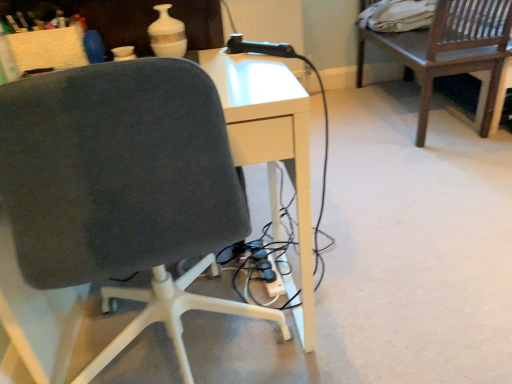
In order to face dark gray fabric chair at center, should I rotate leftwards or rightwards?

Turn left by 13.023 degrees to look at dark gray fabric chair at center.

This screenshot has width=512, height=384. What do you see at coordinates (122, 186) in the screenshot?
I see `dark gray fabric chair at center` at bounding box center [122, 186].

The width and height of the screenshot is (512, 384). I want to click on dark gray fabric chair at center, so click(122, 186).

Based on the photo, in order to face dark wood chair at upper right, should I rotate leftwards or rightwards?

Turn right by 21.095 degrees to look at dark wood chair at upper right.

Describe the element at coordinates (450, 50) in the screenshot. The height and width of the screenshot is (384, 512). I see `dark wood chair at upper right` at that location.

The width and height of the screenshot is (512, 384). What are the coordinates of `dark wood chair at upper right` in the screenshot? It's located at (450, 50).

Identify the location of dark gray fabric chair at center. pos(122,186).

Can you confirm if dark gray fabric chair at center is positioned to the left of dark wood chair at upper right?

Yes, dark gray fabric chair at center is to the left of dark wood chair at upper right.

Is dark gray fabric chair at center in front of or behind dark wood chair at upper right in the image?

Clearly, dark gray fabric chair at center is in front of dark wood chair at upper right.

Which is closer to the camera, (158, 252) or (490, 106)?

Point (158, 252) is positioned closer to the camera compared to point (490, 106).

From the image's perspective, between dark gray fabric chair at center and dark wood chair at upper right, who is located below?

dark gray fabric chair at center, from the image's perspective.

From a real-world perspective, which is physically above, dark gray fabric chair at center or dark wood chair at upper right?

In real-world perspective, dark gray fabric chair at center is above.

Which of these two, dark gray fabric chair at center or dark wood chair at upper right, is wider?

With larger width is dark gray fabric chair at center.

Considering the sizes of objects dark gray fabric chair at center and dark wood chair at upper right in the image provided, who is taller, dark gray fabric chair at center or dark wood chair at upper right?

dark gray fabric chair at center.

Does dark gray fabric chair at center have a larger size compared to dark wood chair at upper right?

Incorrect, dark gray fabric chair at center is not larger than dark wood chair at upper right.

Would you say dark gray fabric chair at center is outside dark wood chair at upper right?

That's correct, dark gray fabric chair at center is outside of dark wood chair at upper right.

From the picture: Is dark gray fabric chair at center far away from dark wood chair at upper right?

Indeed, dark gray fabric chair at center is not near dark wood chair at upper right.

Is dark gray fabric chair at center oriented towards dark wood chair at upper right?

No, dark gray fabric chair at center is not oriented towards dark wood chair at upper right.

Measure the distance between dark gray fabric chair at center and dark wood chair at upper right.

The distance of dark gray fabric chair at center from dark wood chair at upper right is 1.70 meters.

Image resolution: width=512 pixels, height=384 pixels. Find the location of `table below the dark gray fabric chair at center (from a real-world perspective)`. table below the dark gray fabric chair at center (from a real-world perspective) is located at coordinates (450, 50).

Can you confirm if dark wood chair at upper right is positioned to the right of dark gray fabric chair at center?

Correct, you'll find dark wood chair at upper right to the right of dark gray fabric chair at center.

Considering their positions, is dark wood chair at upper right located in front of or behind dark gray fabric chair at center?

Visually, dark wood chair at upper right is located behind dark gray fabric chair at center.

Which is nearer, (424, 85) or (18, 232)?

The point (18, 232) is closer.

From the image's perspective, is dark wood chair at upper right located above dark gray fabric chair at center?

Yes, from the image's perspective, dark wood chair at upper right is above dark gray fabric chair at center.

From a real-world perspective, is dark wood chair at upper right physically located above or below dark gray fabric chair at center?

Clearly, from a real-world perspective, dark wood chair at upper right is below dark gray fabric chair at center.

Is dark wood chair at upper right wider or thinner than dark gray fabric chair at center?

Considering their sizes, dark wood chair at upper right looks slimmer than dark gray fabric chair at center.

Considering the relative sizes of dark wood chair at upper right and dark gray fabric chair at center in the image provided, is dark wood chair at upper right shorter than dark gray fabric chair at center?

Yes.

Is dark wood chair at upper right bigger or smaller than dark gray fabric chair at center?

Clearly, dark wood chair at upper right is larger in size than dark gray fabric chair at center.

Is dark wood chair at upper right outside of dark gray fabric chair at center?

That's correct, dark wood chair at upper right is outside of dark gray fabric chair at center.

Is there a large distance between dark wood chair at upper right and dark gray fabric chair at center?

Absolutely, dark wood chair at upper right is distant from dark gray fabric chair at center.

Could you tell me if dark wood chair at upper right is turned towards dark gray fabric chair at center?

No, dark wood chair at upper right is not turned towards dark gray fabric chair at center.

How different are the orientations of dark wood chair at upper right and dark gray fabric chair at center in degrees?

The angle between the facing direction of dark wood chair at upper right and the facing direction of dark gray fabric chair at center is 92.2 degrees.

In order to click on table lying above the dark gray fabric chair at center (from the image's perspective) in this screenshot , I will do `click(450, 50)`.

At what (x,y) coordinates should I click in order to perform the action: click on table that is above the dark gray fabric chair at center (from the image's perspective). Please return your answer as a coordinate pair (x, y). The height and width of the screenshot is (384, 512). Looking at the image, I should click on (450, 50).

In the image, there is a dark gray fabric chair at center. What are the coordinates of `table below it (from a real-world perspective)` in the screenshot? It's located at (450, 50).